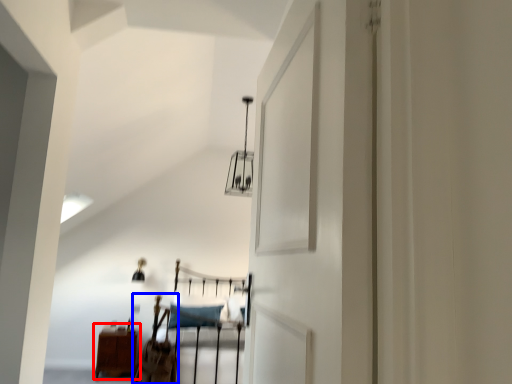
Question: Which of the following is the farthest to the observer, furniture (highlighted by a red box) or chair (highlighted by a blue box)?

Choices:
 (A) furniture
 (B) chair

Answer: (A)